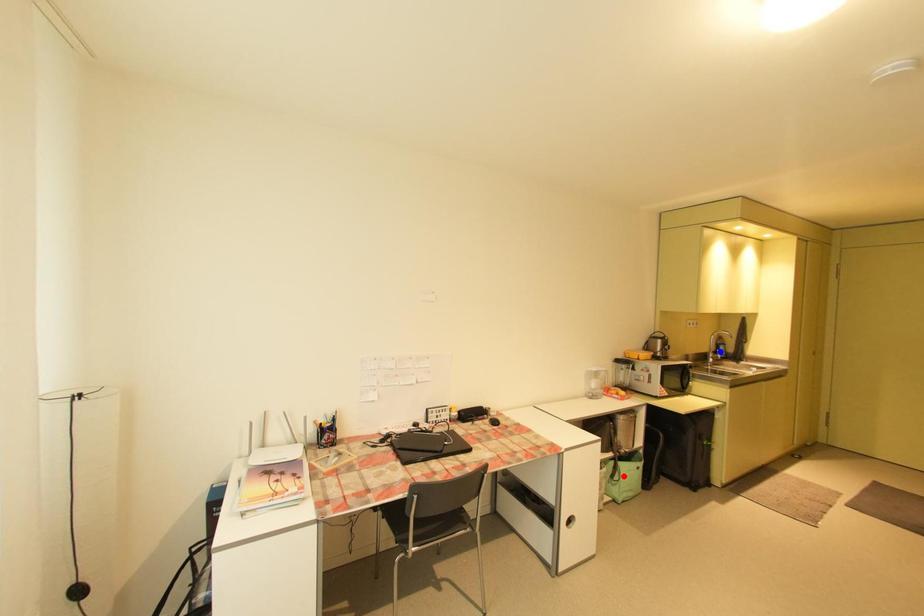
Question: In the image, two points are highlighted. Which point is nearer to the camera? Reply with the corresponding letter.

Choices:
 (A) blue point
 (B) red point

Answer: (B)